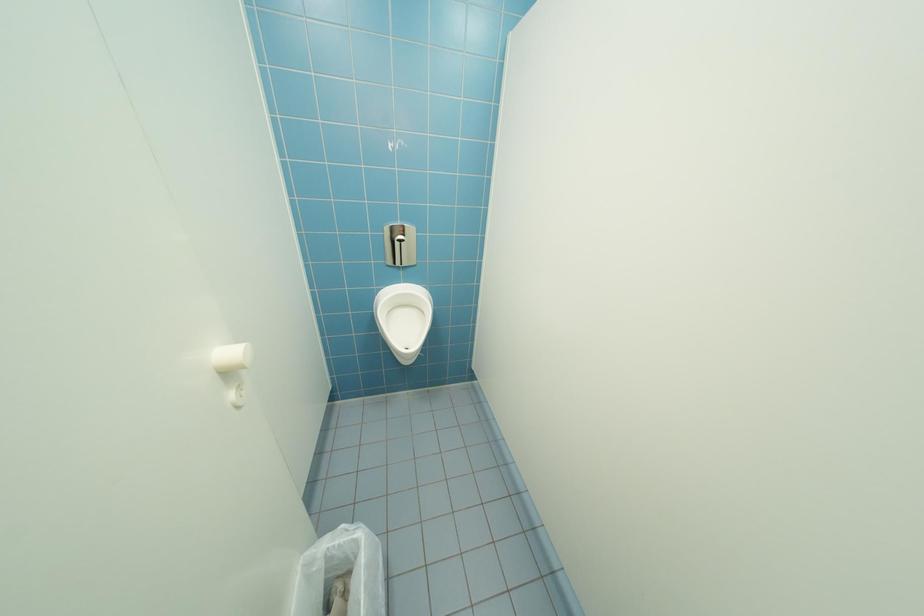
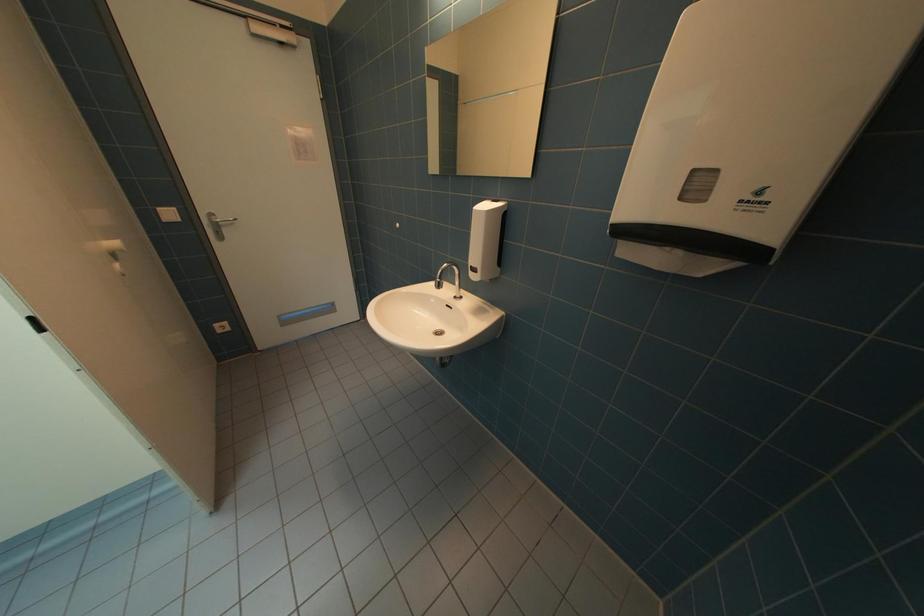
Based on the continuous images, in which direction is the camera rotating?

The rotation direction of the camera is right-down.